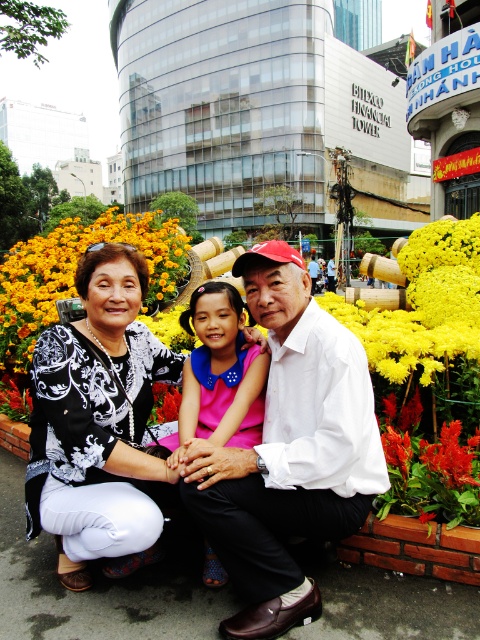
Question: Is white matte shirt at center positioned in front of pink satin dress at center?

Choices:
 (A) no
 (B) yes

Answer: (B)

Question: Is yellow matte flowers at center to the left of pink satin dress at center from the viewer's perspective?

Choices:
 (A) no
 (B) yes

Answer: (B)

Question: Considering the real-world distances, which object is farthest from the white matte shirt at center?

Choices:
 (A) black printed blouse at center
 (B) yellow matte flowers at center

Answer: (B)

Question: Is white matte shirt at center closer to the viewer compared to yellow matte flowers at center?

Choices:
 (A) no
 (B) yes

Answer: (B)

Question: Which of these objects is positioned closest to the white matte shirt at center?

Choices:
 (A) black printed blouse at center
 (B) yellow matte flowers at center
 (C) pink satin dress at center

Answer: (C)

Question: Which object is positioned farthest from the black printed blouse at center?

Choices:
 (A) pink satin dress at center
 (B) white matte shirt at center

Answer: (B)